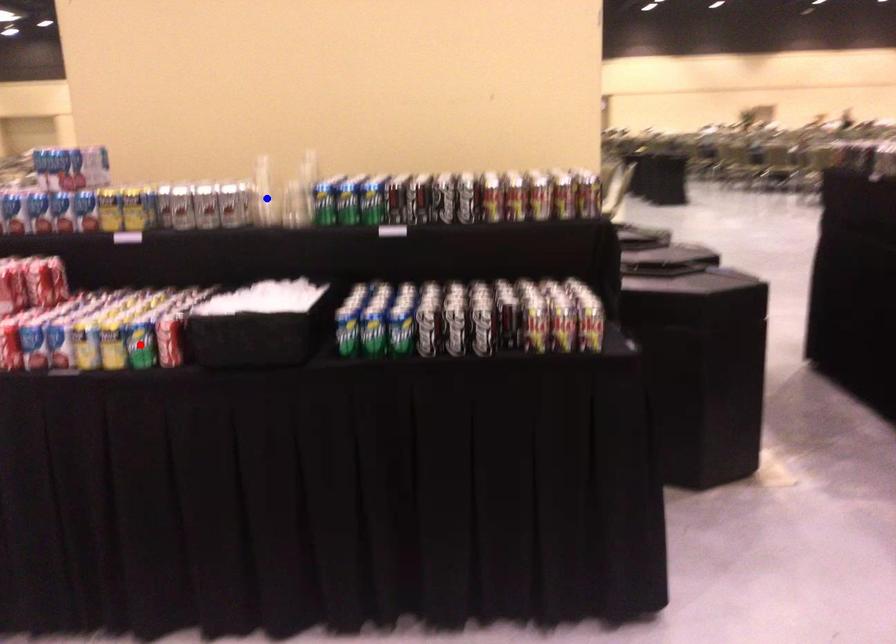
Question: Two points are marked on the image. Which point is closer to the camera?

Choices:
 (A) Blue point is closer.
 (B) Red point is closer.

Answer: (B)